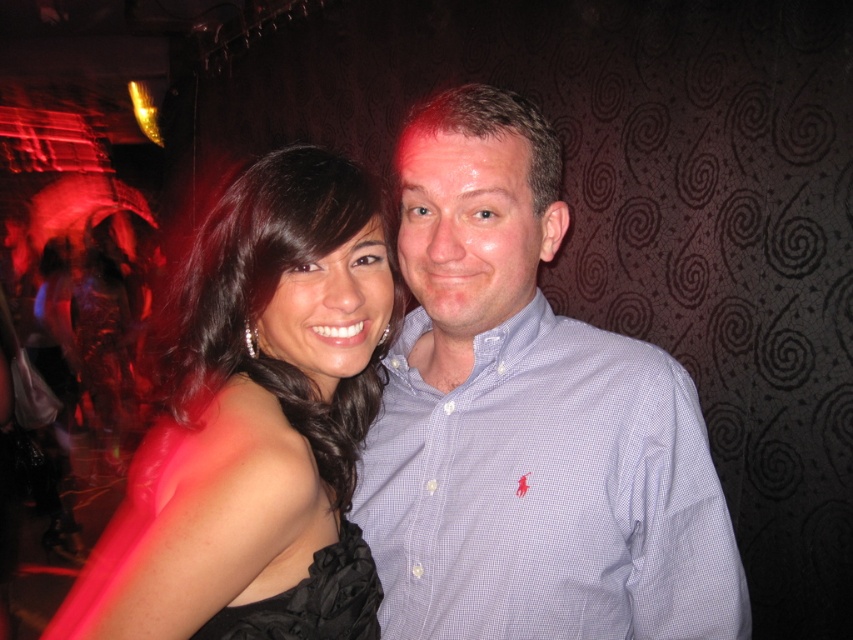
Question: Does blue checkered shirt at center have a smaller size compared to black satin dress at center?

Choices:
 (A) no
 (B) yes

Answer: (B)

Question: Which point appears farthest from the camera in this image?

Choices:
 (A) (184, 465)
 (B) (683, 602)

Answer: (B)

Question: Among these points, which one is nearest to the camera?

Choices:
 (A) (363, 228)
 (B) (535, 420)

Answer: (A)

Question: Considering the relative positions of blue checkered shirt at center and black satin dress at center in the image provided, where is blue checkered shirt at center located with respect to black satin dress at center?

Choices:
 (A) below
 (B) above

Answer: (B)

Question: From the image, what is the correct spatial relationship of blue checkered shirt at center in relation to black satin dress at center?

Choices:
 (A) below
 (B) above

Answer: (B)

Question: Among these points, which one is farthest from the camera?

Choices:
 (A) (660, 404)
 (B) (154, 561)

Answer: (A)